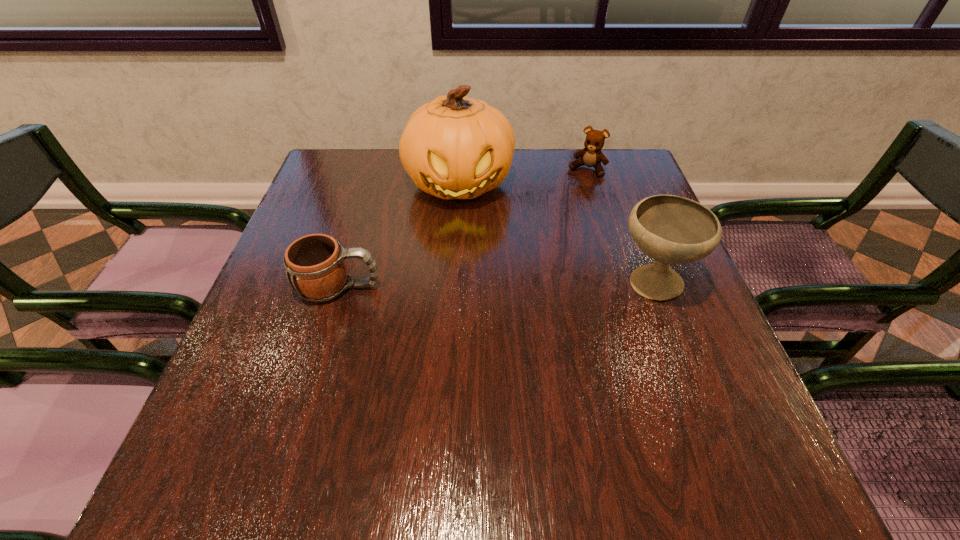
Image resolution: width=960 pixels, height=540 pixels. Identify the location of vacant space on the desktop that is between the leftmost object and the second tallest object and is positioned on the front-facing side of the teddy bear. (520, 285).

This screenshot has height=540, width=960. I want to click on vacant space on the desktop that is between the leftmost object and the second tallest object and is positioned on the front face of the pumpkin, so click(476, 285).